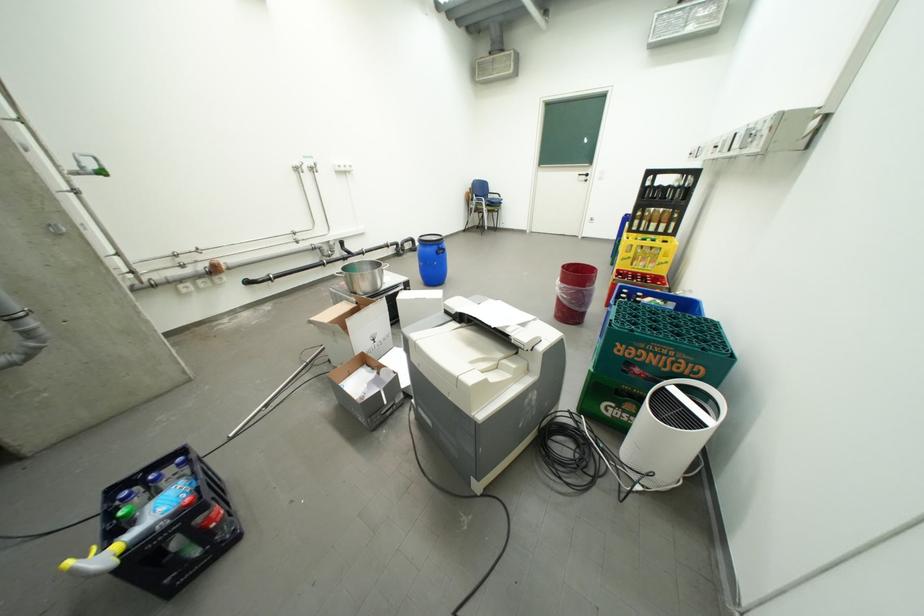
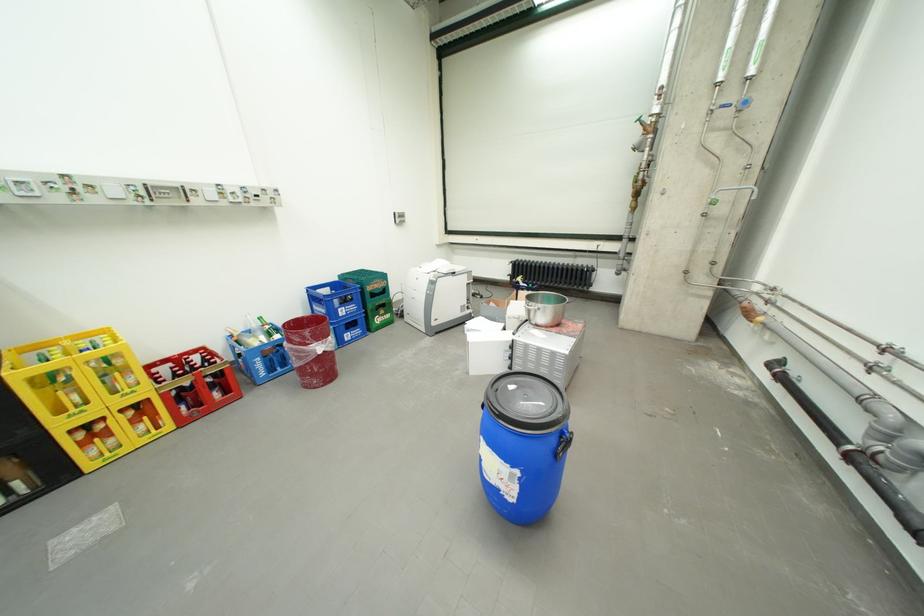
Locate, in the second image, the point that corresponds to point 637,236 in the first image.

(30, 374)